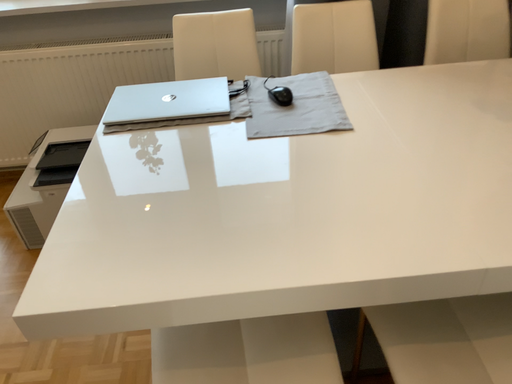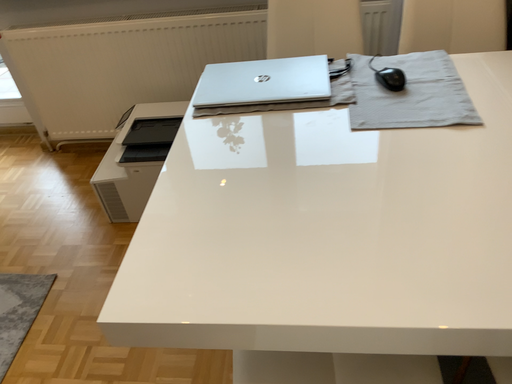
Question: How did the camera likely rotate when shooting the video?

Choices:
 (A) rotated right
 (B) rotated left

Answer: (B)